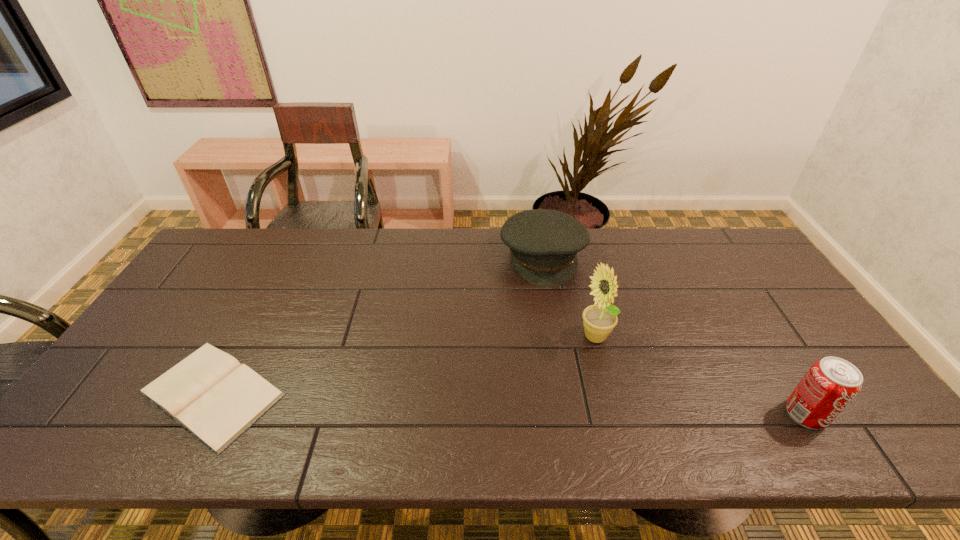
Where is `vacant space on the desktop that is between the leftmost object and the rightmost object and is positioned on the face of the tallest object`? vacant space on the desktop that is between the leftmost object and the rightmost object and is positioned on the face of the tallest object is located at coordinates (546, 404).

Where is `vacant space on the desktop that is between the shortest object and the soda can and is positioned on the front-facing side of the beret`? The height and width of the screenshot is (540, 960). vacant space on the desktop that is between the shortest object and the soda can and is positioned on the front-facing side of the beret is located at coordinates (579, 406).